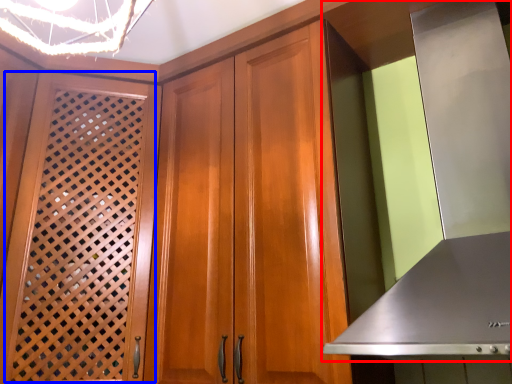
Question: Which object appears farthest to the camera in this image, exhaust hood (highlighted by a red box) or screen door (highlighted by a blue box)?

Choices:
 (A) exhaust hood
 (B) screen door

Answer: (B)